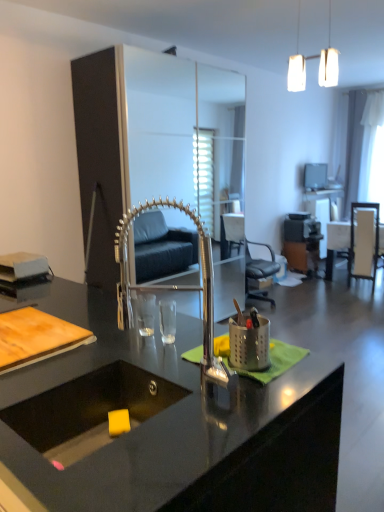
Question: Would you consider black leather chair at center, acting as the 1th chair starting from the left, to be distant from white glossy table at right, which is counted as the 1th table, starting from the front?

Choices:
 (A) no
 (B) yes

Answer: (B)

Question: Is black leather chair at center, which is the 2th chair in right-to-left order, to the right of white glossy table at right, positioned as the second table in back-to-front order, from the viewer's perspective?

Choices:
 (A) yes
 (B) no

Answer: (B)

Question: From a real-world perspective, is black leather chair at center, acting as the 1th chair starting from the left, on top of white glossy table at right, which is counted as the 1th table, starting from the front?

Choices:
 (A) no
 (B) yes

Answer: (B)

Question: Is black leather chair at center, acting as the 1th chair starting from the left, looking in the opposite direction of white glossy table at right, positioned as the second table in back-to-front order?

Choices:
 (A) yes
 (B) no

Answer: (B)

Question: Is black leather chair at center, acting as the 1th chair starting from the left, directly adjacent to white glossy table at right, which is counted as the 1th table, starting from the front?

Choices:
 (A) no
 (B) yes

Answer: (A)

Question: Is the depth of black leather chair at center, acting as the 1th chair starting from the left, greater than that of white glossy table at right, which is counted as the 1th table, starting from the front?

Choices:
 (A) yes
 (B) no

Answer: (B)

Question: Considering the relative sizes of white glossy table at right, acting as the first table starting from the back, and black granite sink at center in the image provided, is white glossy table at right, acting as the first table starting from the back, taller than black granite sink at center?

Choices:
 (A) yes
 (B) no

Answer: (A)

Question: From a real-world perspective, is white glossy table at right, the 2th table in the front-to-back sequence, physically above black granite sink at center?

Choices:
 (A) no
 (B) yes

Answer: (A)

Question: Does white glossy table at right, the 2th table in the front-to-back sequence, have a larger size compared to black granite sink at center?

Choices:
 (A) no
 (B) yes

Answer: (B)

Question: From the image's perspective, is white glossy table at right, acting as the first table starting from the back, beneath black granite sink at center?

Choices:
 (A) no
 (B) yes

Answer: (A)

Question: Are white glossy table at right, acting as the first table starting from the back, and black granite sink at center making contact?

Choices:
 (A) no
 (B) yes

Answer: (A)

Question: From a real-world perspective, is white glossy table at right, acting as the first table starting from the back, beneath black granite sink at center?

Choices:
 (A) yes
 (B) no

Answer: (A)

Question: Is wooden chair at right, marked as the 1th chair in a right-to-left arrangement, looking in the opposite direction of white glossy table at right, positioned as the second table in back-to-front order?

Choices:
 (A) no
 (B) yes

Answer: (B)